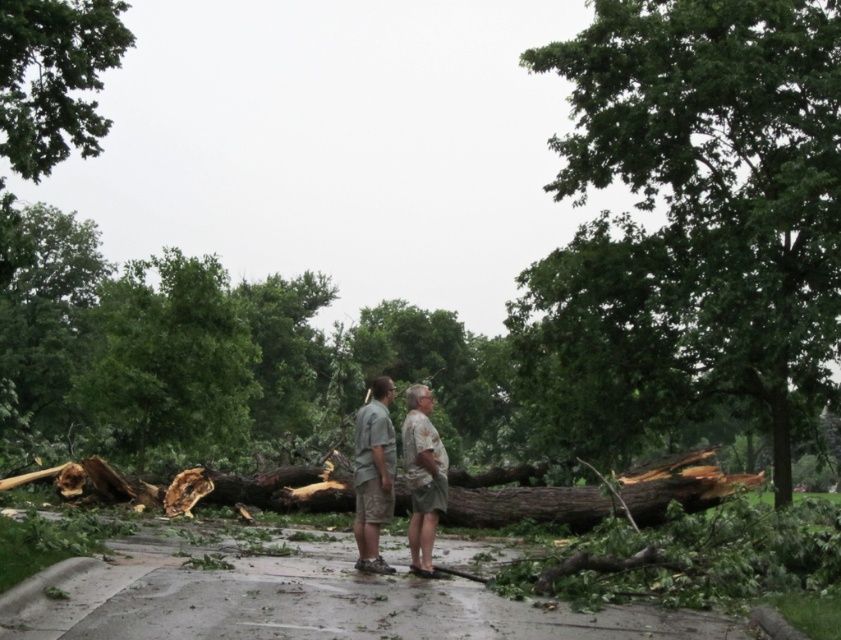
Question: Does camouflage shorts at center appear on the left side of camouflage shirt at center?

Choices:
 (A) no
 (B) yes

Answer: (B)

Question: Based on their relative distances, which object is nearer to the camouflage shorts at center?

Choices:
 (A) green leafy tree at upper left
 (B) camouflage shirt at center
 (C) camouflage fabric shorts at center
 (D) green rough bark tree at center

Answer: (C)

Question: Among these points, which one is nearest to the camera?

Choices:
 (A) (20, 13)
 (B) (434, 532)
 (C) (664, 360)
 (D) (356, 509)

Answer: (B)

Question: From the image, what is the correct spatial relationship of camouflage shorts at center in relation to camouflage shirt at center?

Choices:
 (A) below
 (B) above

Answer: (B)

Question: Which point is farther to the camera?

Choices:
 (A) camouflage fabric shorts at center
 (B) green leafy tree at upper left
 (C) camouflage shirt at center
 (D) camouflage shorts at center

Answer: (B)

Question: Is green leafy tree at upper left positioned at the back of camouflage shirt at center?

Choices:
 (A) no
 (B) yes

Answer: (B)